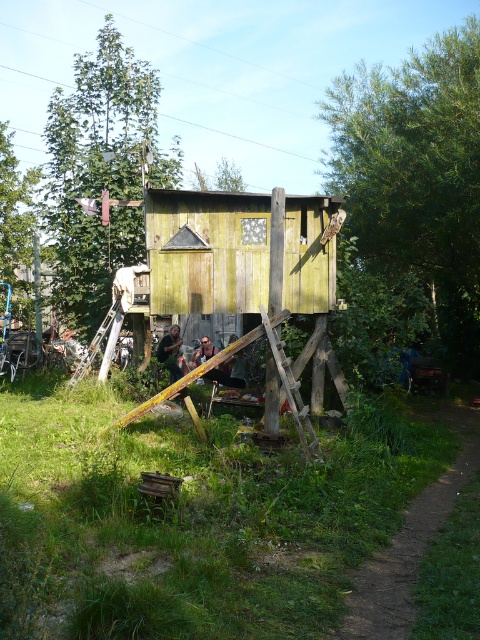
You are standing at the base of the ramp leading to the cabin. Looking up towards the entrance, which object is located at the coordinate point (100, 172)?

The point at coordinate (100, 172) indicates a green leafy tree at upper left.

You are standing at the base of the ramp leading to the cabin. You notice a specific point marked at coordinates point (193, 518). What is located at that point?

The point (193, 518) marks green grass at lower center.